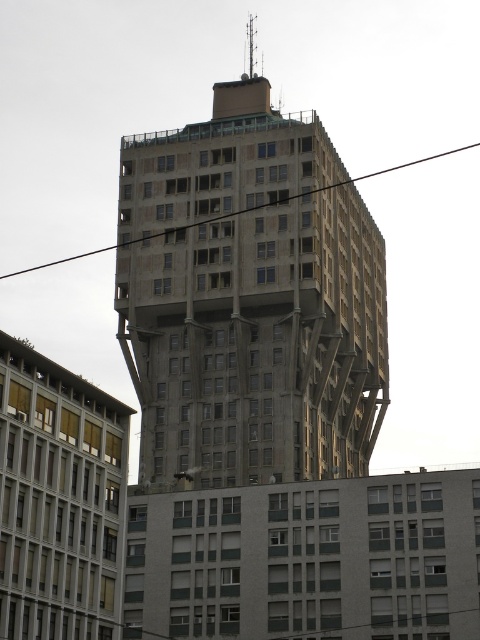
Who is higher up, concrete building at center or black wire at upper center?

Positioned higher is concrete building at center.

Does concrete building at center have a greater width compared to black wire at upper center?

No.

At what (x,y) coordinates should I click in order to perform the action: click on concrete building at center. Please return your answer as a coordinate pair (x, y). Looking at the image, I should click on (250, 298).

Locate an element on the screen. The height and width of the screenshot is (640, 480). concrete building at center is located at coordinates (250, 298).